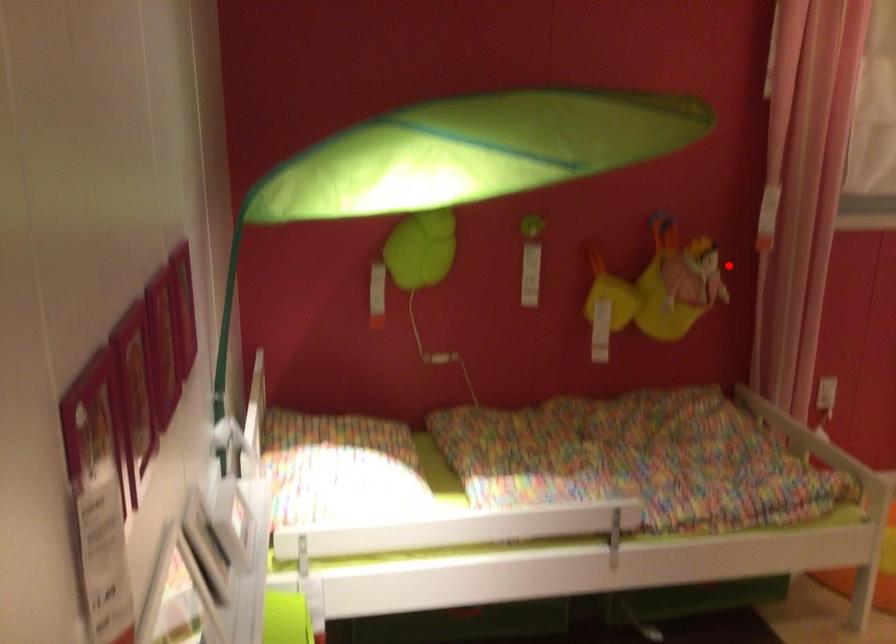
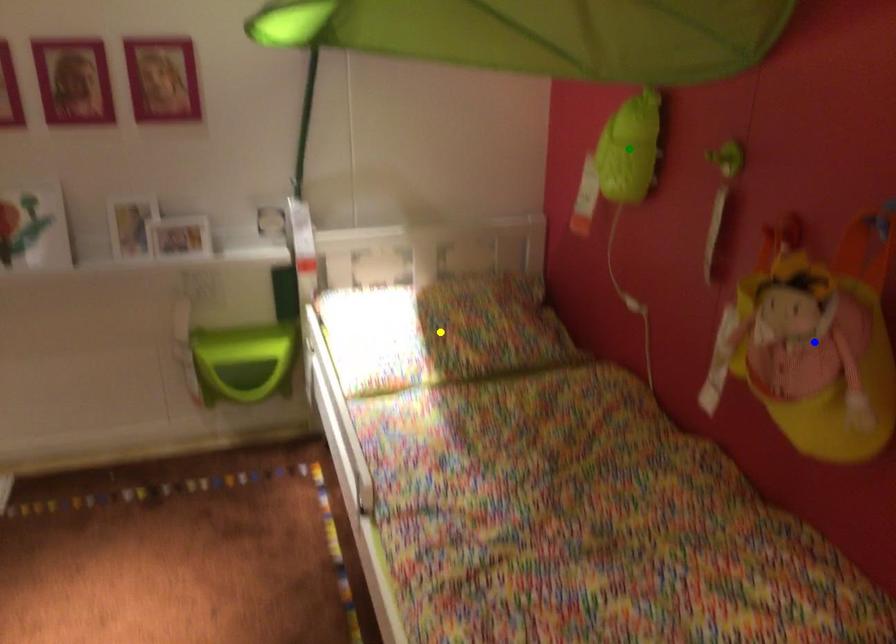
Question: I am providing you with two images of the same scene from different viewpoints. A red point is marked on the first image. You are given multiple points on the second image. Which point in image 2 represents the same 3d spot as the red point in image 1?

Choices:
 (A) blue point
 (B) yellow point
 (C) green point

Answer: (A)